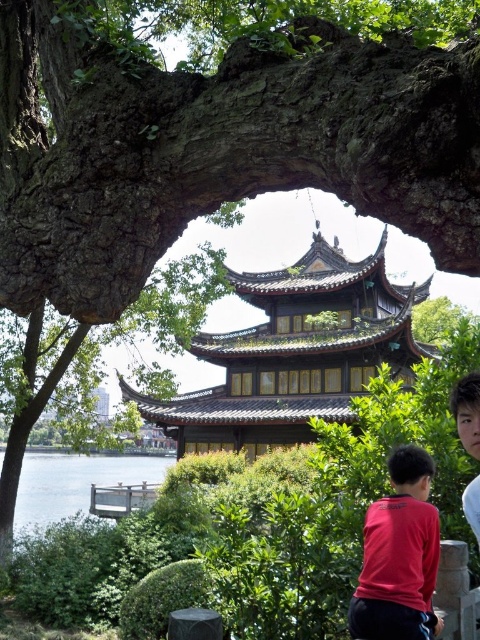
You are standing in the scene and see two points marked in the image. Which point is closer to you, point (220,358) or point (459,426)?

Point (220,358) is closer to you than point (459,426).